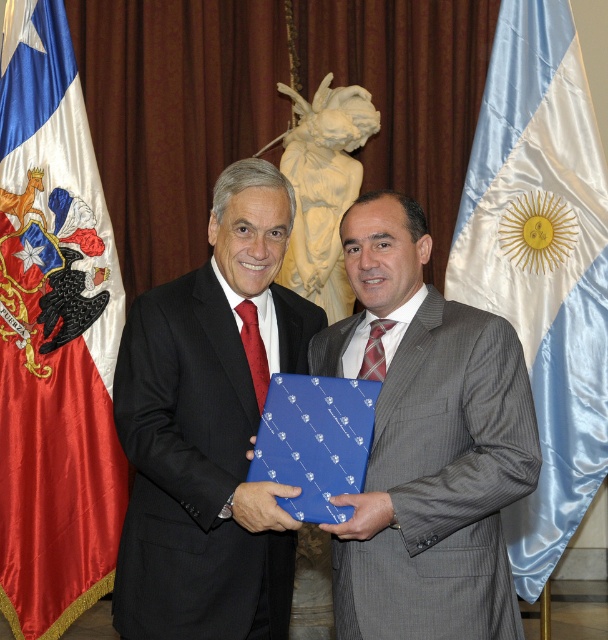
Can you confirm if blue satin flag at right is thinner than blue paper/plastic at center?

No, blue satin flag at right is not thinner than blue paper/plastic at center.

This screenshot has width=608, height=640. What do you see at coordinates (541, 262) in the screenshot?
I see `blue satin flag at right` at bounding box center [541, 262].

Is point (562, 516) positioned in front of point (271, 413)?

That is False.

This screenshot has width=608, height=640. What are the coordinates of `blue satin flag at right` in the screenshot? It's located at (541, 262).

Is black matte suit at center shorter than red satin flag at left?

Yes.

In the scene shown: Is black matte suit at center below red satin flag at left?

Indeed, black matte suit at center is positioned under red satin flag at left.

Between point (246, 321) and point (7, 333), which one is positioned behind?

The point (7, 333) is behind.

Find the location of a particular element. black matte suit at center is located at coordinates (209, 426).

In the scene shown: Between gray pinstripe suit at center and blue satin flag at right, which one appears on the right side from the viewer's perspective?

From the viewer's perspective, blue satin flag at right appears more on the right side.

This screenshot has width=608, height=640. In order to click on gray pinstripe suit at center in this screenshot , I will do `click(426, 442)`.

Is point (430, 292) more distant than point (472, 228)?

No, (430, 292) is in front of (472, 228).

The height and width of the screenshot is (640, 608). What are the coordinates of `gray pinstripe suit at center` in the screenshot? It's located at (426, 442).